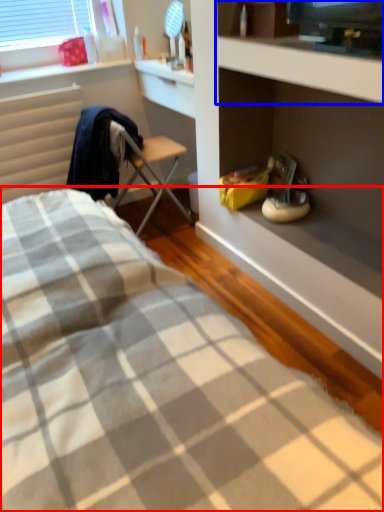
Question: Which object appears closest to the camera in this image, bed (highlighted by a red box) or cabinet (highlighted by a blue box)?

Choices:
 (A) bed
 (B) cabinet

Answer: (A)